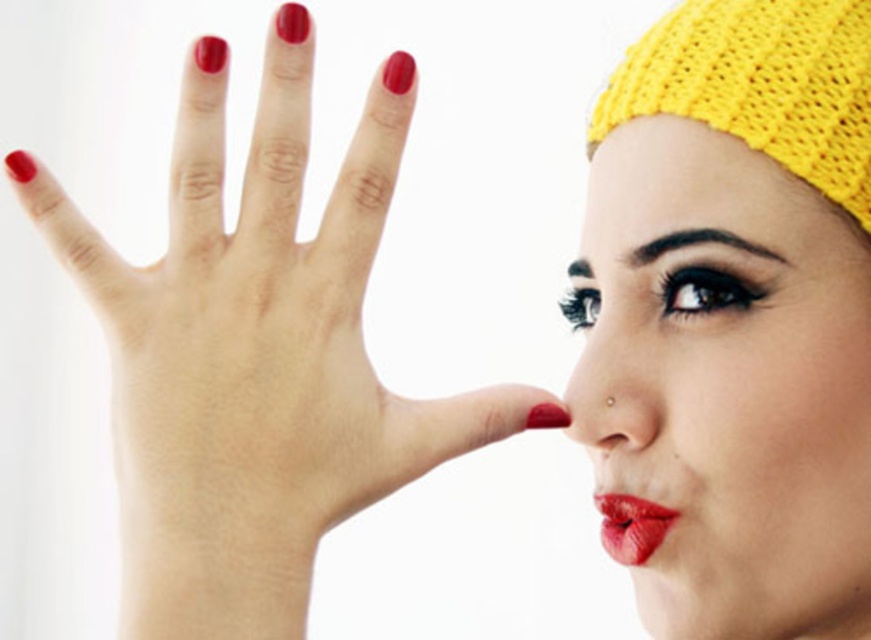
How far apart are the matte red nails at center?

The matte red nails at center are 10.79 inches apart.

You are a photographer adjusting the camera focus. You need to ensure both the matte red nails at center and the matte gold nose at center are in focus. Which object should you focus on first to ensure both are sharp?

You should focus on the matte gold nose at center first because it is behind the matte red nails at center. By focusing on the farther object first, you can ensure that the closer object will also be in focus within the depth of field.

In the scene shown: You are a makeup artist preparing to apply a new accessory. You have a small sticker that is 1 cm wide. You want to place it on either the matte red nails at center or the matte gold nose at center. Based on their widths, which object can the sticker fit on without overlapping?

The matte red nails at center is wider than the matte gold nose at center. Since the sticker is 1 cm wide, it can fit on the matte red nails at center without overlapping, but may not fit on the narrower matte gold nose at center.